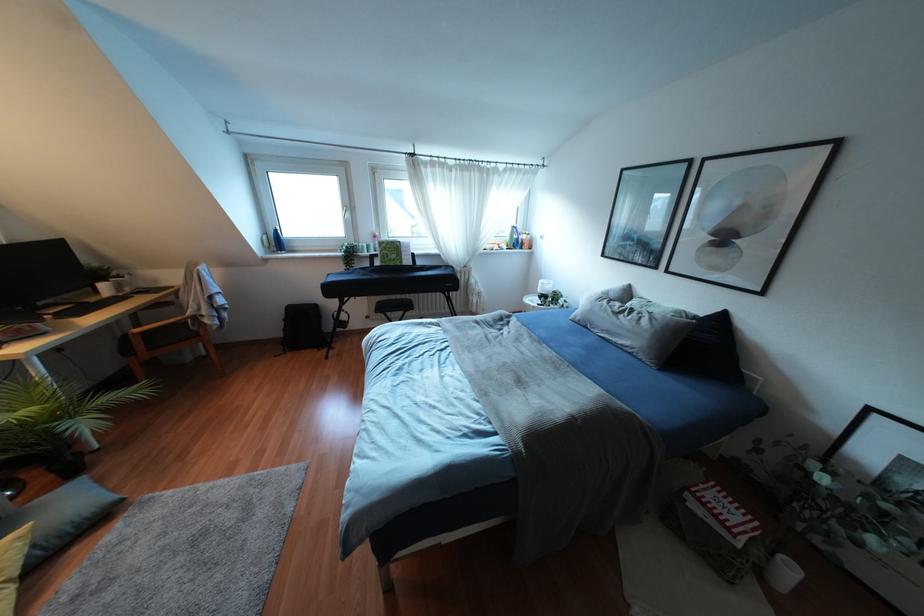
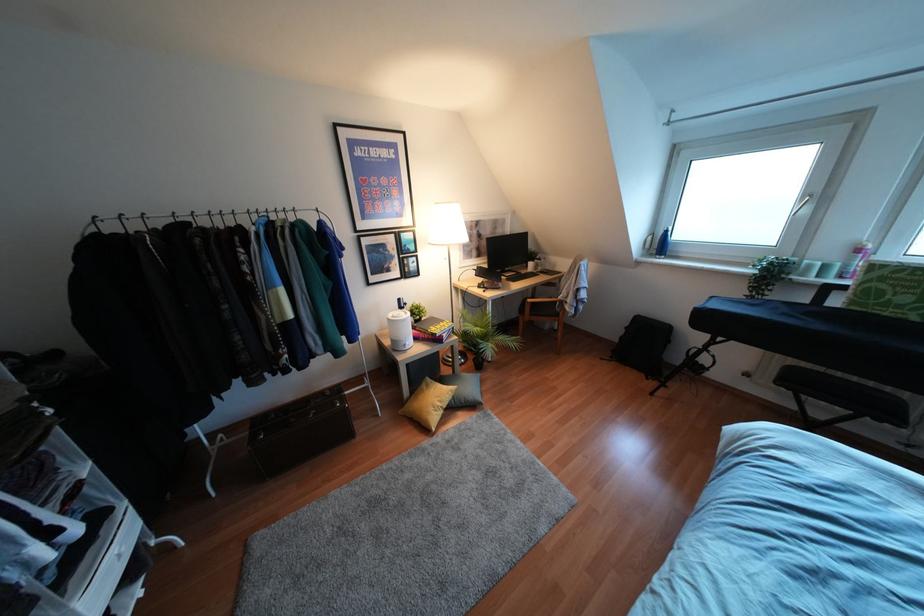
Locate, in the second image, the point that corresponds to (361,246) in the first image.

(809, 265)